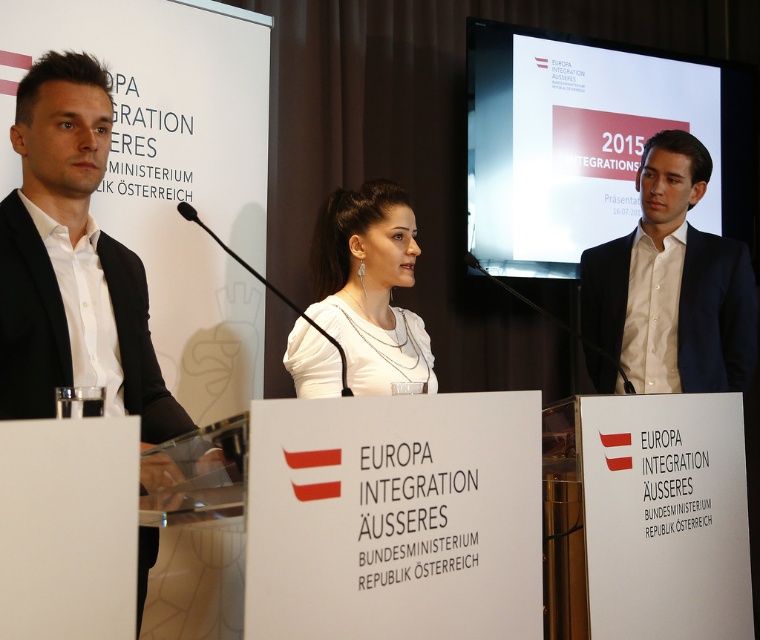
Question: Can you confirm if white shirt at center is positioned below white matte shirt at center?

Choices:
 (A) yes
 (B) no

Answer: (B)

Question: Which point is closer to the camera?

Choices:
 (A) white shirt at center
 (B) white matte shirt at center

Answer: (B)

Question: Considering the relative positions of white shirt at center and white matte shirt at center in the image provided, where is white shirt at center located with respect to white matte shirt at center?

Choices:
 (A) above
 (B) below

Answer: (A)

Question: From the image, what is the correct spatial relationship of white shirt at center in relation to white matte shirt at center?

Choices:
 (A) right
 (B) left

Answer: (A)

Question: Which object is farther from the camera taking this photo?

Choices:
 (A) white shirt at center
 (B) white matte shirt at center

Answer: (A)

Question: Which point is closer to the camera?

Choices:
 (A) (714, 305)
 (B) (380, 179)

Answer: (B)